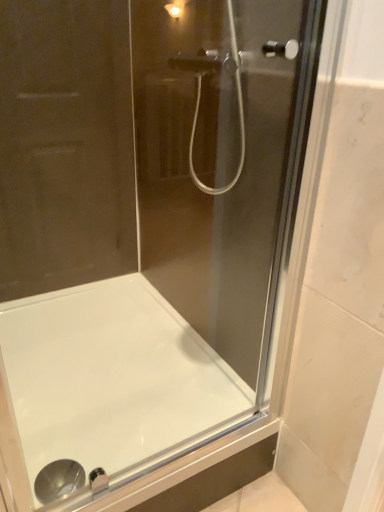
Question: Should I look upward or downward to see white glossy bathtub at center?

Choices:
 (A) down
 (B) up

Answer: (A)